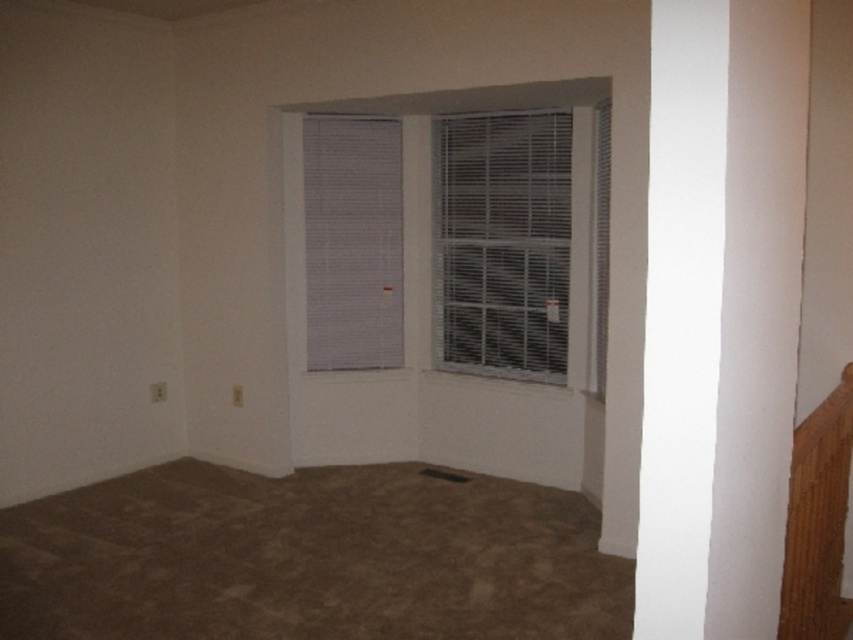
In the scene shown: You are an interior designer assessing the room layout. You need to install a new wall shelf between the two windows. The shelf must be placed above the white plastic blinds at center but below the white textured blinds at upper center. Is this possible given their positions?

The white plastic blinds at center is much taller than the white textured blinds at upper center, meaning there is insufficient vertical space between them to install the shelf. Therefore, it is not possible to place the shelf in the desired location.

You are standing in the room and want to plug in a lamp that requires an outlet. The outlet is located near the bottom left corner. Considering the white textured blinds at upper center are 14.82 feet away from you, can you estimate how far you need to move to reach the outlet?

The white textured blinds at upper center are 14.82 feet away from the camera, so you need to move approximately 14.82 feet towards the bottom left corner to reach the outlet near there.

In the scene shown: You are standing in the room depicted in the image. You want to place a 16 feet long ladder from your current position to the point at coordinates point (444, 280). Will the ladder fit without bending or overlapping?

The distance to point (444, 280) is 15.44 feet, so the 16 feet ladder is longer than the required distance. Therefore, the ladder will not fit without bending or overlapping.